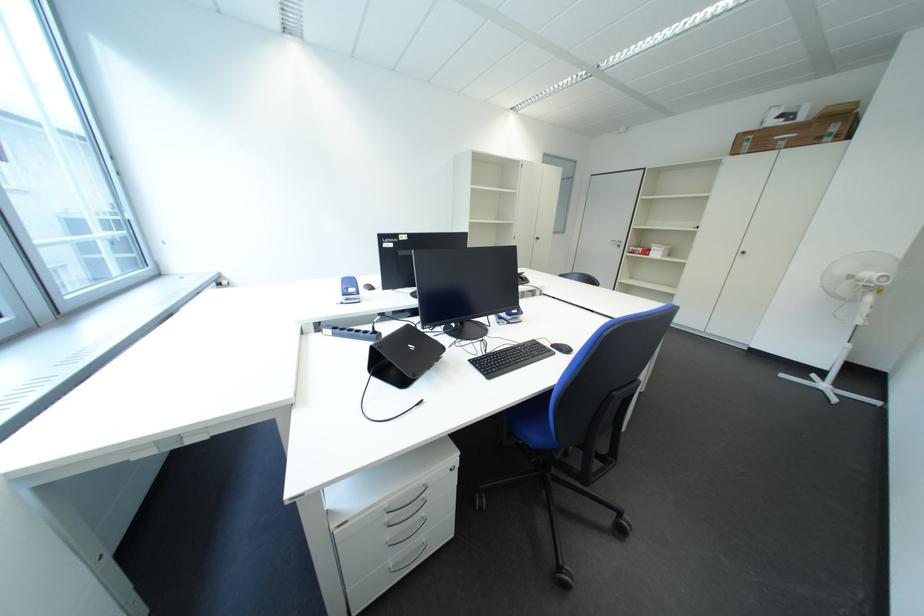
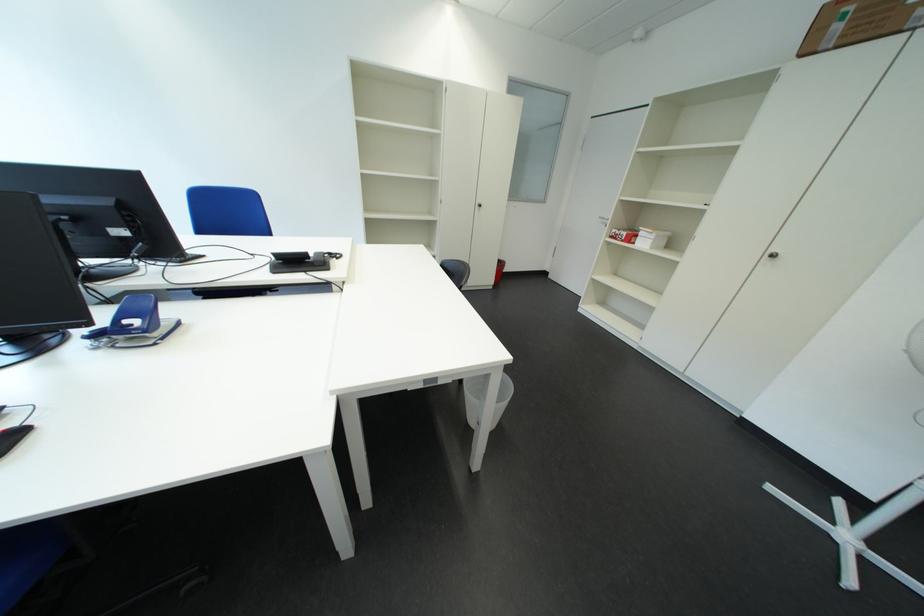
In the second image, find the point that corresponds to point 669,257 in the first image.

(657, 246)